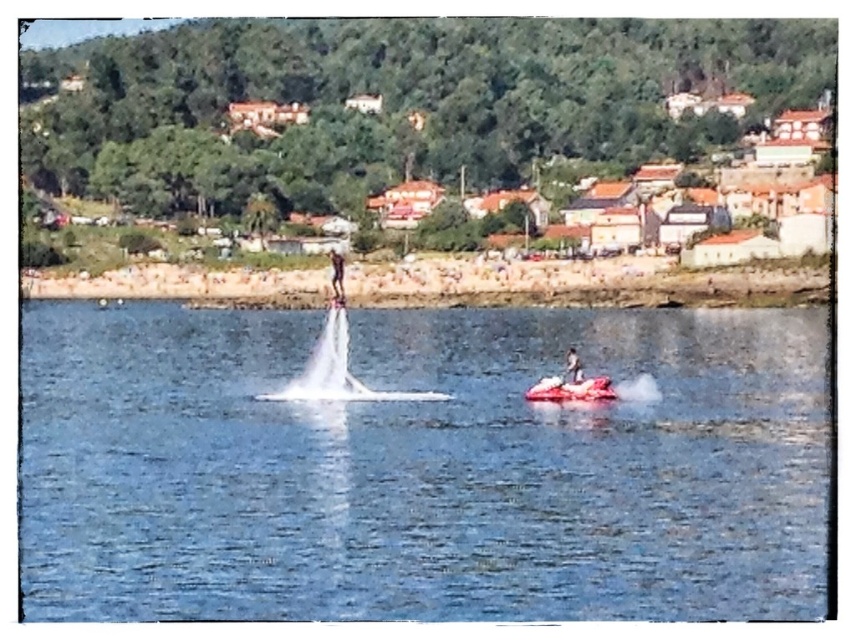
You are a lifeguard on duty at the lake and need to determine which object is shorter between the red rubber boat at center and the smooth white surfboard at center. Based on the scene, which one should you report?

The red rubber boat at center is shorter than the smooth white surfboard at center, so you should report that the red rubber boat at center is shorter.

You are a lifeguard on duty at the beach and see the smooth skin person at upper center and the smooth white surfboard at center. You need to reach the person first. Which object is closer to you?

The smooth skin person at upper center is closer to you than the smooth white surfboard at center, so you should reach them first.

You are a photographer standing on the shore of the lake and want to capture both the red rubber boat at center and the smooth skin person at upper center in a single shot. Based on their positions, which object should you focus on first to ensure both are in frame?

The red rubber boat at center is located below the smooth skin person at upper center. To capture both in a single shot, focus on the smooth skin person at upper center first, as they are higher up, ensuring the boat below remains within the frame.